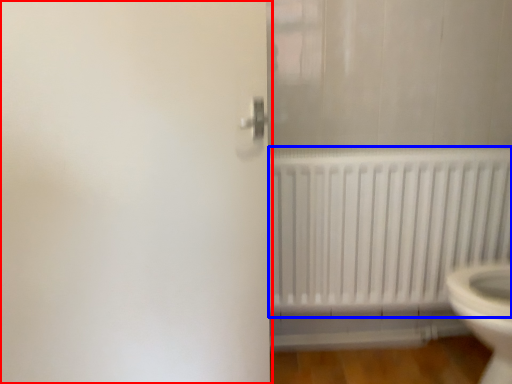
Question: Which of the following is the closest to the observer, screen door (highlighted by a red box) or radiator (highlighted by a blue box)?

Choices:
 (A) screen door
 (B) radiator

Answer: (A)